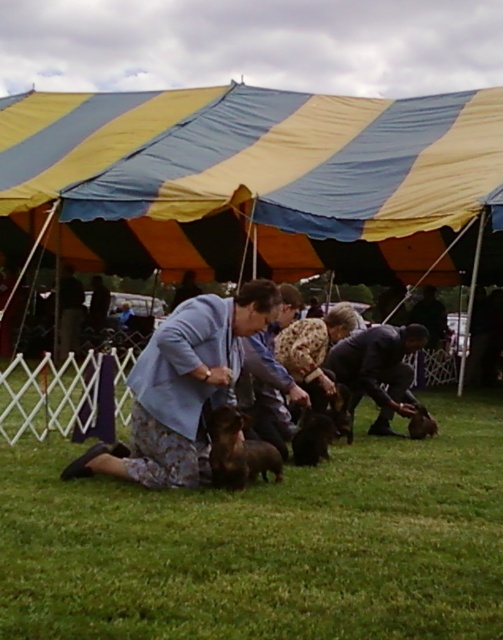
You are a photographer at the dog show and need to ensure all subjects are in frame. Given the dark blue shirt at center and brown furry dog at center, which one has a greater width?

The dark blue shirt at center might be wider than brown furry dog at center, so the dark blue shirt at center has a greater width.

You are a photographer at the dog show and want to take a photo of the yellow striped tent at center and the fluffy brown dog at center. Can you see both of them clearly in the same frame?

The fluffy brown dog at center is behind the yellow striped tent at center, so the dog may be partially or fully obscured by the tent in the photo.